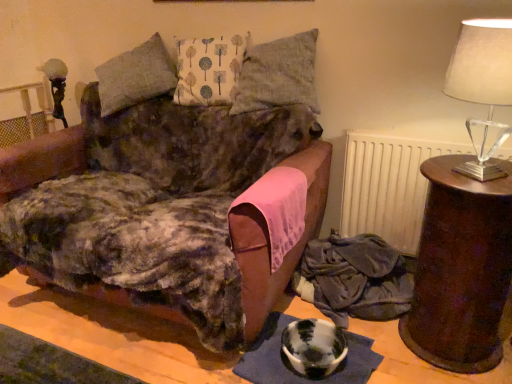
I want to click on velvet brown couch at center, so click(x=179, y=199).

The width and height of the screenshot is (512, 384). What are the coordinates of `textured linen pillow at upper center, which ranks as the first pillow in right-to-left order` in the screenshot? It's located at (277, 74).

What is the approximate height of marble-like white bowl at lower center?

It is 4.04 inches.

Locate an element on the screen. The width and height of the screenshot is (512, 384). white printed cushion at center, the 2th pillow from the right is located at coordinates (208, 69).

At what (x,y) coordinates should I click in order to perform the action: click on white matte radiator at upper right. Please return your answer as a coordinate pair (x, y). The image size is (512, 384). Looking at the image, I should click on (388, 185).

Between textured linen pillow at upper center, the second pillow when ordered from left to right, and white printed cushion at center, the 2th pillow from the right, which one appears on the left side from the viewer's perspective?

From the viewer's perspective, white printed cushion at center, the 2th pillow from the right, appears more on the left side.

Does point (305, 84) lie in front of point (195, 79)?

Yes.

Consider the image. Is the depth of textured linen pillow at upper center, which ranks as the first pillow in right-to-left order, less than that of white printed cushion at center, the 2th pillow from the right?

Yes.

Which object is further away from the camera, textured linen pillow at upper center, which ranks as the first pillow in right-to-left order, or velvet brown couch at center?

textured linen pillow at upper center, which ranks as the first pillow in right-to-left order, is further away from the camera.

Where is `the 1st pillow above the velvet brown couch at center (from the image's perspective)`? This screenshot has height=384, width=512. the 1st pillow above the velvet brown couch at center (from the image's perspective) is located at coordinates (277, 74).

From a real-world perspective, is textured linen pillow at upper center, the second pillow when ordered from left to right, positioned above or below velvet brown couch at center?

textured linen pillow at upper center, the second pillow when ordered from left to right, is situated higher than velvet brown couch at center in the real world.

How much distance is there between textured linen pillow at upper center, which ranks as the first pillow in right-to-left order, and velvet brown couch at center?

textured linen pillow at upper center, which ranks as the first pillow in right-to-left order, is 14.22 inches from velvet brown couch at center.

Considering the sizes of objects velvet fabric blanket at lower right and brown wooden side table at right in the image provided, who is wider, velvet fabric blanket at lower right or brown wooden side table at right?

Wider between the two is brown wooden side table at right.

Considering the positions of objects velvet fabric blanket at lower right and brown wooden side table at right in the image provided, who is more to the right, velvet fabric blanket at lower right or brown wooden side table at right?

From the viewer's perspective, brown wooden side table at right appears more on the right side.

How many degrees apart are the facing directions of velvet fabric blanket at lower right and brown wooden side table at right?

They differ by 4.93 degrees in their facing directions.

From a real-world perspective, is velvet fabric blanket at lower right positioned above or below brown wooden side table at right?

velvet fabric blanket at lower right is situated lower than brown wooden side table at right in the real world.

From the image's perspective, is textured linen pillow at upper center, which ranks as the first pillow in right-to-left order, under brown wooden side table at right?

No, from the image's perspective, textured linen pillow at upper center, which ranks as the first pillow in right-to-left order, is not below brown wooden side table at right.

Between textured linen pillow at upper center, which ranks as the first pillow in right-to-left order, and brown wooden side table at right, which one appears on the right side from the viewer's perspective?

From the viewer's perspective, brown wooden side table at right appears more on the right side.

Considering the sizes of textured linen pillow at upper center, which ranks as the first pillow in right-to-left order, and brown wooden side table at right in the image, is textured linen pillow at upper center, which ranks as the first pillow in right-to-left order, wider or thinner than brown wooden side table at right?

textured linen pillow at upper center, which ranks as the first pillow in right-to-left order, is thinner than brown wooden side table at right.

Is textured linen pillow at upper center, which ranks as the first pillow in right-to-left order, facing away from brown wooden side table at right?

textured linen pillow at upper center, which ranks as the first pillow in right-to-left order, is not turned away from brown wooden side table at right.

Considering the positions of points (330, 370) and (337, 317), is point (330, 370) closer to camera compared to point (337, 317)?

Yes, point (330, 370) is in front of point (337, 317).

Which of these two, marble-like white bowl at lower center or velvet fabric blanket at lower right, stands shorter?

Standing shorter between the two is marble-like white bowl at lower center.

Is marble-like white bowl at lower center placed right next to velvet fabric blanket at lower right?

They are not placed beside each other.

Which is more to the right, marble-like white bowl at lower center or velvet fabric blanket at lower right?

From the viewer's perspective, velvet fabric blanket at lower right appears more on the right side.

Who is smaller, velvet fabric blanket at lower right or white printed cushion at center, the 2th pillow from the right?

Smaller between the two is velvet fabric blanket at lower right.

Is velvet fabric blanket at lower right at the left side of white printed cushion at center, placed as the first pillow when sorted from left to right?

In fact, velvet fabric blanket at lower right is to the right of white printed cushion at center, placed as the first pillow when sorted from left to right.

From the image's perspective, is velvet fabric blanket at lower right positioned above or below white printed cushion at center, the 2th pillow from the right?

From the image's perspective, velvet fabric blanket at lower right appears below white printed cushion at center, the 2th pillow from the right.

How different are the orientations of velvet fabric blanket at lower right and white printed cushion at center, placed as the first pillow when sorted from left to right, in degrees?

17.9 degrees.

Considering the positions of points (337, 347) and (258, 69), is point (337, 347) closer to camera compared to point (258, 69)?

Yes, it is.

In the scene shown: Is marble-like white bowl at lower center closer to the viewer compared to textured linen pillow at upper center, the second pillow when ordered from left to right?

That is True.

In terms of width, does marble-like white bowl at lower center look wider or thinner when compared to textured linen pillow at upper center, the second pillow when ordered from left to right?

Considering their sizes, marble-like white bowl at lower center looks slimmer than textured linen pillow at upper center, the second pillow when ordered from left to right.

Locate an element on the screen. This screenshot has height=384, width=512. pillow behind the textured linen pillow at upper center, the second pillow when ordered from left to right is located at coordinates pyautogui.click(x=208, y=69).

The width and height of the screenshot is (512, 384). I want to click on the 1st pillow directly above the velvet brown couch at center (from a real-world perspective), so click(277, 74).

From the image, which object appears to be farther from translucent glass lampshade at right, textured linen pillow at upper center, which ranks as the first pillow in right-to-left order, or marble-like white bowl at lower center?

Among the two, marble-like white bowl at lower center is located further to translucent glass lampshade at right.

When comparing their distances from velvet fabric blanket at lower right, does white matte radiator at upper right or textured linen pillow at upper center, the second pillow when ordered from left to right, seem closer?

The object closer to velvet fabric blanket at lower right is white matte radiator at upper right.

When comparing their distances from white printed cushion at center, placed as the first pillow when sorted from left to right, does brown wooden side table at right or velvet fabric blanket at lower right seem further?

brown wooden side table at right lies further to white printed cushion at center, placed as the first pillow when sorted from left to right, than the other object.

Based on the photo, estimate the real-world distances between objects in this image. Which object is closer to velvet brown couch at center, white matte radiator at upper right or marble-like white bowl at lower center?

marble-like white bowl at lower center is positioned closer to the anchor velvet brown couch at center.

Which object lies nearer to the anchor point velvet fabric blanket at lower right, textured linen pillow at upper center, which ranks as the first pillow in right-to-left order, or marble-like white bowl at lower center?

marble-like white bowl at lower center.

Estimate the real-world distances between objects in this image. Which object is closer to textured linen pillow at upper center, which ranks as the first pillow in right-to-left order, white matte radiator at upper right or white printed cushion at center, placed as the first pillow when sorted from left to right?

Among the two, white printed cushion at center, placed as the first pillow when sorted from left to right, is located nearer to textured linen pillow at upper center, which ranks as the first pillow in right-to-left order.

Looking at the image, which one is located closer to white printed cushion at center, the 2th pillow from the right, translucent glass lampshade at right or velvet brown couch at center?

The object closer to white printed cushion at center, the 2th pillow from the right, is velvet brown couch at center.

Considering their positions, is textured linen pillow at upper center, the second pillow when ordered from left to right, positioned further to velvet fabric blanket at lower right than white matte radiator at upper right?

textured linen pillow at upper center, the second pillow when ordered from left to right, lies further to velvet fabric blanket at lower right than the other object.

Where is `table that lies between white printed cushion at center, placed as the first pillow when sorted from left to right, and marble-like white bowl at lower center from top to bottom`? The image size is (512, 384). table that lies between white printed cushion at center, placed as the first pillow when sorted from left to right, and marble-like white bowl at lower center from top to bottom is located at coordinates [461, 268].

Image resolution: width=512 pixels, height=384 pixels. Find the location of `lamp between white printed cushion at center, placed as the first pillow when sorted from left to right, and marble-like white bowl at lower center in the up-down direction`. lamp between white printed cushion at center, placed as the first pillow when sorted from left to right, and marble-like white bowl at lower center in the up-down direction is located at coordinates (483, 87).

You are a GUI agent. You are given a task and a screenshot of the screen. Output one action in this format:
    pyautogui.click(x=<x>, y=<y>)
    Task: Click on the lamp situated between velvet brown couch at center and brown wooden side table at right from left to right
    
    Given the screenshot: What is the action you would take?
    pyautogui.click(x=483, y=87)

Image resolution: width=512 pixels, height=384 pixels. I want to click on radiator between textured linen pillow at upper center, which ranks as the first pillow in right-to-left order, and brown wooden side table at right, in the vertical direction, so click(x=388, y=185).